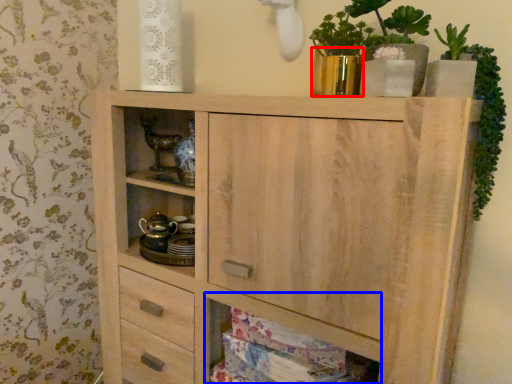
Question: Which object appears farthest to the camera in this image, glass vase (highlighted by a red box) or cabinet (highlighted by a blue box)?

Choices:
 (A) glass vase
 (B) cabinet

Answer: (A)